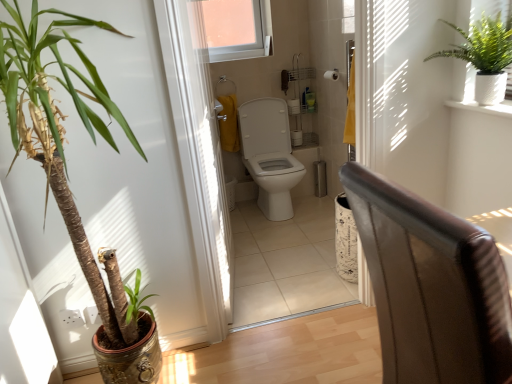
You are a GUI agent. You are given a task and a screenshot of the screen. Output one action in this format:
    pyautogui.click(x=<x>, y=<y>)
    Task: Click on the green leafy plant at left, the second houseplant from the right
    The image size is (512, 384).
    Given the screenshot: What is the action you would take?
    pyautogui.click(x=63, y=137)

Consider the image. Measure the distance between point (328, 71) and camera.

10.03 feet.

I want to click on leather armchair at right, so click(431, 287).

In order to face white glossy toilet at center, should I rotate leftwards or rightwards?

To face it directly, rotate right by 2.069 degrees.

Where is `white glossy toilet at center`? This screenshot has width=512, height=384. white glossy toilet at center is located at coordinates (270, 155).

In order to click on white plastic screen door at center in this screenshot , I will do `click(198, 140)`.

Identify the location of green leafy plant at left, the second houseplant from the right. The image size is (512, 384). (63, 137).

Considering the sizes of objects green leafy plant at left, the first houseplant from the left, and leather armchair at right in the image provided, who is smaller, green leafy plant at left, the first houseplant from the left, or leather armchair at right?

leather armchair at right is smaller.

Image resolution: width=512 pixels, height=384 pixels. What are the coordinates of `armchair that is in front of the green leafy plant at left, the second houseplant from the right` in the screenshot? It's located at coord(431,287).

How different are the orientations of green leafy plant at left, the first houseplant from the left, and leather armchair at right in degrees?

90.1 degrees separate the facing orientations of green leafy plant at left, the first houseplant from the left, and leather armchair at right.

Consider the image. Is green leafy plant at left, the second houseplant from the right, at the right side of leather armchair at right?

Incorrect, green leafy plant at left, the second houseplant from the right, is not on the right side of leather armchair at right.

From the image's perspective, does green leafy plant at left, the first houseplant from the left, appear higher than clear glass window at upper center?

No.

Which is more to the left, green leafy plant at left, the first houseplant from the left, or clear glass window at upper center?

From the viewer's perspective, green leafy plant at left, the first houseplant from the left, appears more on the left side.

Between green leafy plant at left, the first houseplant from the left, and clear glass window at upper center, which one has larger width?

green leafy plant at left, the first houseplant from the left.

Locate an element on the screen. The image size is (512, 384). houseplant that is the 2nd one when counting forward from the clear glass window at upper center is located at coordinates (63, 137).

Between leather armchair at right and white glossy toilet at center, which one has smaller size?

With smaller size is white glossy toilet at center.

Is leather armchair at right turned away from white glossy toilet at center?

No.

Which object is further away from the camera, leather armchair at right or white glossy toilet at center?

white glossy toilet at center is more distant.

Could you tell me if green leafy plant at left, the first houseplant from the left, is turned towards white plastic screen door at center?

No, green leafy plant at left, the first houseplant from the left, is not facing towards white plastic screen door at center.

Considering the points (47, 49) and (215, 206), which point is in front, point (47, 49) or point (215, 206)?

The point (47, 49) is closer to the camera.

Locate an element on the screen. The height and width of the screenshot is (384, 512). screen door that appears on the right of green leafy plant at left, the second houseplant from the right is located at coordinates (198, 140).

From a real-world perspective, is green leafy plant at left, the first houseplant from the left, physically above white plastic screen door at center?

Incorrect, from a real-world perspective, green leafy plant at left, the first houseplant from the left, is lower than white plastic screen door at center.

Based on the photo, how much distance is there between leather armchair at right and white matte toilet paper at upper center?

leather armchair at right and white matte toilet paper at upper center are 7.70 feet apart from each other.

Locate an element on the screen. This screenshot has height=384, width=512. toilet paper above the leather armchair at right (from a real-world perspective) is located at coordinates (332, 75).

Which object is positioned more to the right, leather armchair at right or white matte toilet paper at upper center?

From the viewer's perspective, leather armchair at right appears more on the right side.

Identify the location of toilet paper that is behind the white plastic screen door at center. (332, 75).

Looking at this image, from the image's perspective, is white matte toilet paper at upper center above white plastic screen door at center?

Yes.

Is white matte toilet paper at upper center at the left side of white plastic screen door at center?

No.

Can you see green textured plant at upper right, the first houseplant positioned from the right, touching clear glass window at upper center?

No, green textured plant at upper right, the first houseplant positioned from the right, is not next to clear glass window at upper center.

Is green textured plant at upper right, the 2th houseplant positioned from the left, facing away from clear glass window at upper center?

No.

In order to click on window above the green textured plant at upper right, the first houseplant positioned from the right (from a real-world perspective) in this screenshot , I will do `click(237, 29)`.

Is green textured plant at upper right, the first houseplant positioned from the right, positioned beyond the bounds of clear glass window at upper center?

Yes, green textured plant at upper right, the first houseplant positioned from the right, is not within clear glass window at upper center.

The image size is (512, 384). I want to click on armchair beneath the green leafy plant at left, the second houseplant from the right (from a real-world perspective), so click(x=431, y=287).

You are a GUI agent. You are given a task and a screenshot of the screen. Output one action in this format:
    pyautogui.click(x=<x>, y=<y>)
    Task: Click on the window on the right of green leafy plant at left, the second houseplant from the right
    
    Given the screenshot: What is the action you would take?
    pyautogui.click(x=237, y=29)

Looking at the image, which one is located further to white glossy toilet at center, white plastic screen door at center or green textured plant at upper right, the 2th houseplant positioned from the left?

green textured plant at upper right, the 2th houseplant positioned from the left, is further to white glossy toilet at center.

Which object lies further to the anchor point clear glass window at upper center, green leafy plant at left, the first houseplant from the left, or white glossy toilet at center?

The object further to clear glass window at upper center is green leafy plant at left, the first houseplant from the left.

Estimate the real-world distances between objects in this image. Which object is closer to green textured plant at upper right, the 2th houseplant positioned from the left, white matte toilet paper at upper center or clear glass window at upper center?

Among the two, white matte toilet paper at upper center is located nearer to green textured plant at upper right, the 2th houseplant positioned from the left.

Based on their spatial positions, is white matte toilet paper at upper center or white plastic screen door at center closer to leather armchair at right?

Among the two, white plastic screen door at center is located nearer to leather armchair at right.

Consider the image. Based on their spatial positions, is leather armchair at right or white plastic screen door at center closer to green leafy plant at left, the second houseplant from the right?

Based on the image, white plastic screen door at center appears to be nearer to green leafy plant at left, the second houseplant from the right.

Considering their positions, is white glossy toilet at center positioned closer to white matte toilet paper at upper center than green textured plant at upper right, the first houseplant positioned from the right?

The object closer to white matte toilet paper at upper center is white glossy toilet at center.

From the image, which object appears to be farther from green leafy plant at left, the second houseplant from the right, white plastic screen door at center or white matte toilet paper at upper center?

Based on the image, white matte toilet paper at upper center appears to be further to green leafy plant at left, the second houseplant from the right.

Estimate the real-world distances between objects in this image. Which object is further from leather armchair at right, white plastic screen door at center or clear glass window at upper center?

Among the two, clear glass window at upper center is located further to leather armchair at right.

You are a GUI agent. You are given a task and a screenshot of the screen. Output one action in this format:
    pyautogui.click(x=<x>, y=<y>)
    Task: Click on the toilet paper positioned between green leafy plant at left, the second houseplant from the right, and clear glass window at upper center from near to far
    
    Given the screenshot: What is the action you would take?
    pyautogui.click(x=332, y=75)

I want to click on screen door between green leafy plant at left, the second houseplant from the right, and leather armchair at right, so click(198, 140).

Locate an element on the screen. The height and width of the screenshot is (384, 512). screen door between leather armchair at right and clear glass window at upper center in the front-back direction is located at coordinates (198, 140).

Image resolution: width=512 pixels, height=384 pixels. I want to click on toilet paper between clear glass window at upper center and white glossy toilet at center from top to bottom, so click(332, 75).